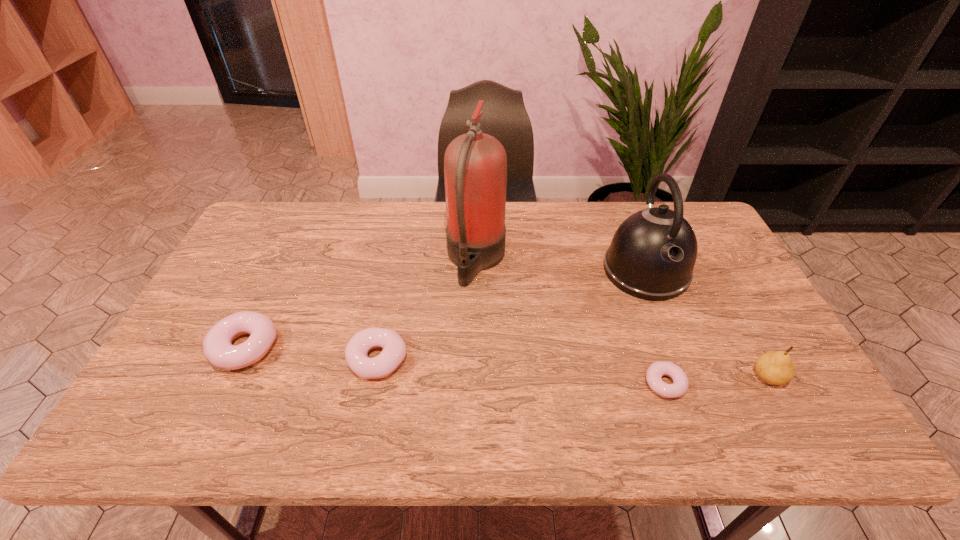
In order to click on blank region between the rightmost object and the second tallest doughnut in this screenshot , I will do `click(573, 368)`.

Locate an element on the screen. Image resolution: width=960 pixels, height=540 pixels. empty location between the shortest object and the fourth object from right to left is located at coordinates (570, 322).

Find the location of a particular element. Image resolution: width=960 pixels, height=540 pixels. blank region between the fire extinguisher and the fifth object from right to left is located at coordinates (427, 309).

Identify the location of free area in between the leftmost object and the pear. (506, 362).

This screenshot has width=960, height=540. Find the location of `vacant space in between the shortest doughnut and the rightmost object`. vacant space in between the shortest doughnut and the rightmost object is located at coordinates (716, 380).

The height and width of the screenshot is (540, 960). Find the location of `free spot between the shortest object and the kettle`. free spot between the shortest object and the kettle is located at coordinates (655, 327).

Locate an element on the screen. vacant area that lies between the third tallest object and the leftmost doughnut is located at coordinates (506, 362).

Locate an element on the screen. free space between the second shortest doughnut and the fire extinguisher is located at coordinates (427, 309).

Identify the location of free space between the pear and the rightmost doughnut. (716, 380).

You are a GUI agent. You are given a task and a screenshot of the screen. Output one action in this format:
    pyautogui.click(x=<x>, y=<y>)
    Task: Click on the free space between the leftmost object and the rightmost doughnut
    
    Given the screenshot: What is the action you would take?
    click(x=454, y=366)